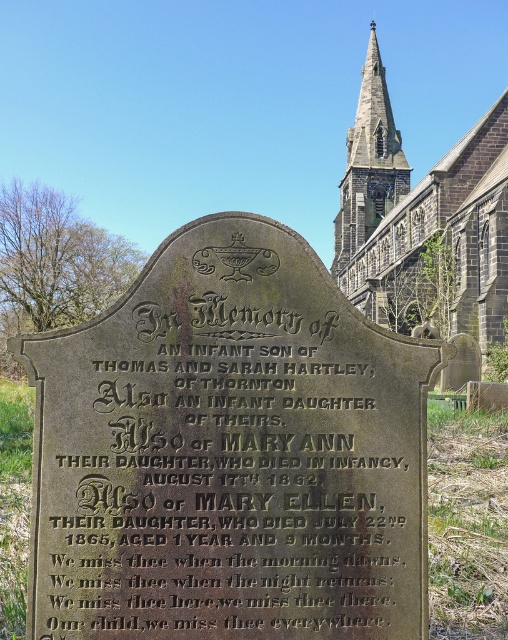
What are the coordinates of the dark gray stone inscription at center?

The coordinates of the dark gray stone inscription at center are at point (229, 472).

You are an archaeologist examining the gravestone. You need to determine which part of the gravestone is wider based on the visible features. Which is wider, the dark gray stone inscription at center or the dark gray stone spire at upper center?

The dark gray stone spire at upper center is wider than the dark gray stone inscription at center.